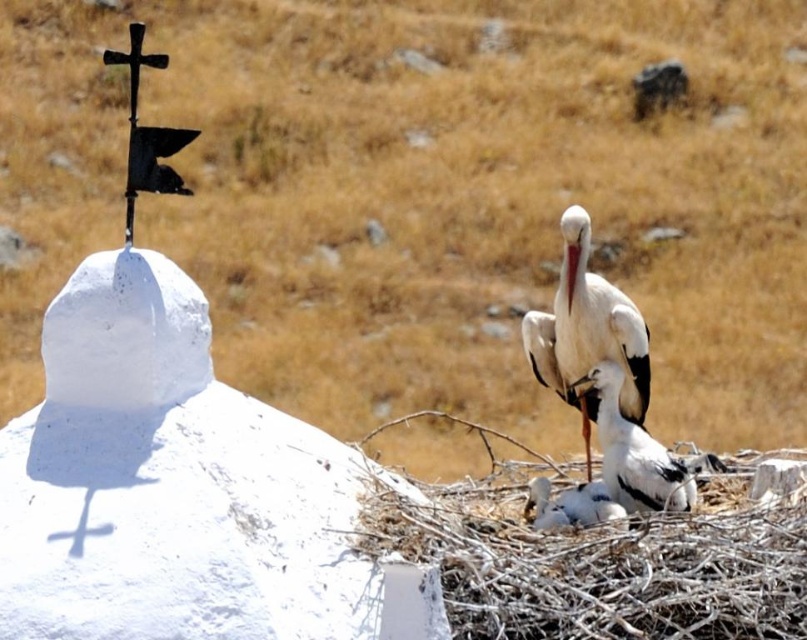
Question: Which of the following is the farthest from the observer?

Choices:
 (A) white feathered stork at center
 (B) white matte stork at center

Answer: (B)

Question: Does white matte stork at center appear over white feathered stork at center?

Choices:
 (A) yes
 (B) no

Answer: (A)

Question: Is white matte stork at center bigger than white feathered stork at center?

Choices:
 (A) no
 (B) yes

Answer: (B)

Question: Does white matte stork at center have a smaller size compared to white feathered stork at center?

Choices:
 (A) no
 (B) yes

Answer: (A)